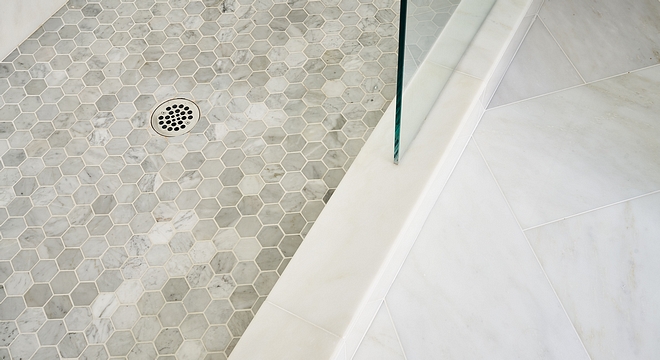
The height and width of the screenshot is (360, 660). What are the coordinates of `bottom left corner of glass door` in the screenshot? It's located at (395, 163).